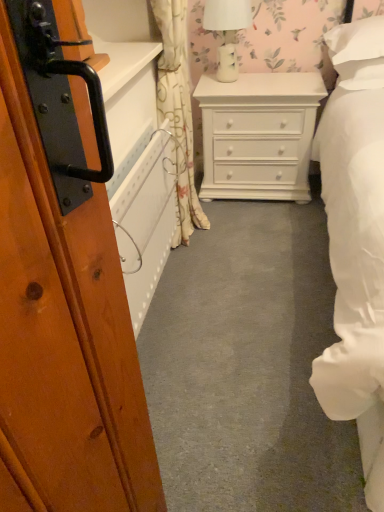
In order to click on empty space that is to the right of white glossy table lamp at upper center in this screenshot , I will do `click(282, 80)`.